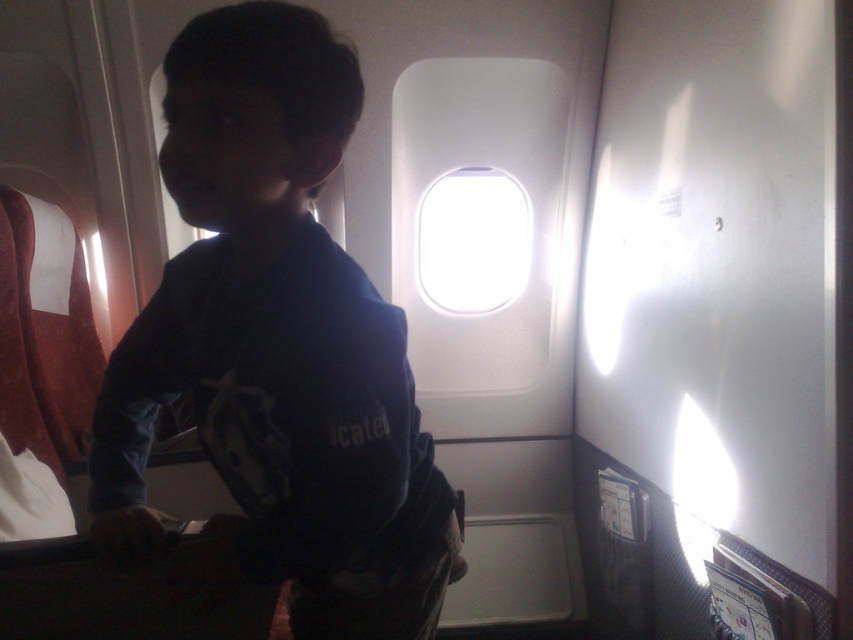
Question: Can you confirm if dark blue shirt at center is positioned to the left of transparent glass airplane window at center?

Choices:
 (A) yes
 (B) no

Answer: (A)

Question: Is dark blue shirt at center closer to camera compared to transparent glass airplane window at center?

Choices:
 (A) yes
 (B) no

Answer: (A)

Question: Among these points, which one is farthest from the camera?

Choices:
 (A) (490, 208)
 (B) (308, 177)

Answer: (A)

Question: Which of the following is the farthest from the observer?

Choices:
 (A) dark blue shirt at center
 (B) transparent glass airplane window at center

Answer: (B)

Question: Does dark blue shirt at center have a lesser width compared to transparent glass airplane window at center?

Choices:
 (A) no
 (B) yes

Answer: (A)